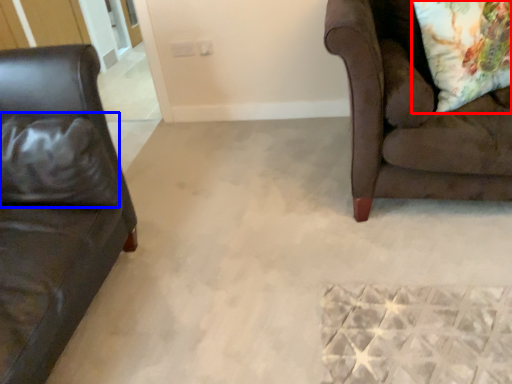
Question: Among these objects, which one is nearest to the camera, throw pillow (highlighted by a red box) or pillow (highlighted by a blue box)?

Choices:
 (A) throw pillow
 (B) pillow

Answer: (B)